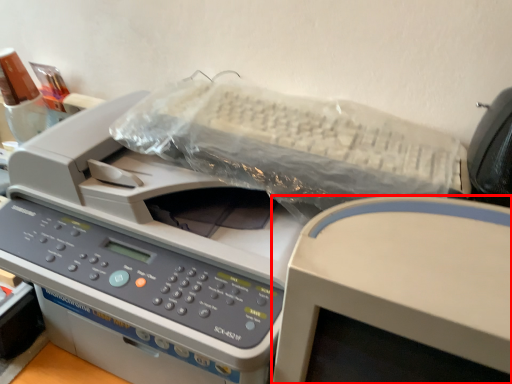
Question: Where is office supplies (annotated by the red box) located in relation to printer in the image?

Choices:
 (A) left
 (B) right

Answer: (B)